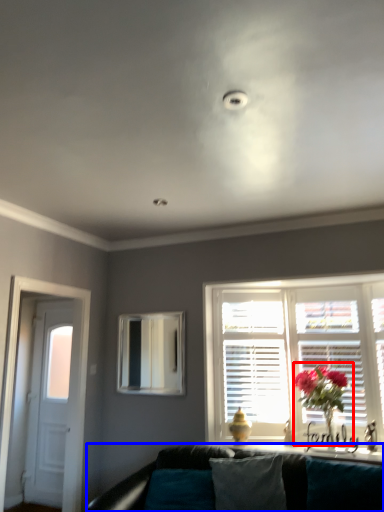
Question: Which of the following is the closest to the observer, floral arrangement (highlighted by a red box) or studio couch (highlighted by a blue box)?

Choices:
 (A) floral arrangement
 (B) studio couch

Answer: (B)